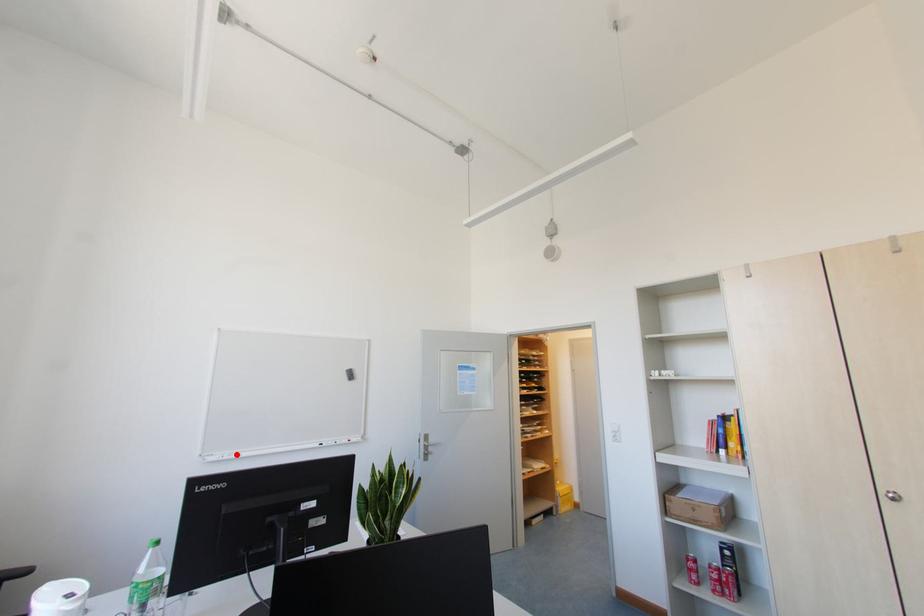
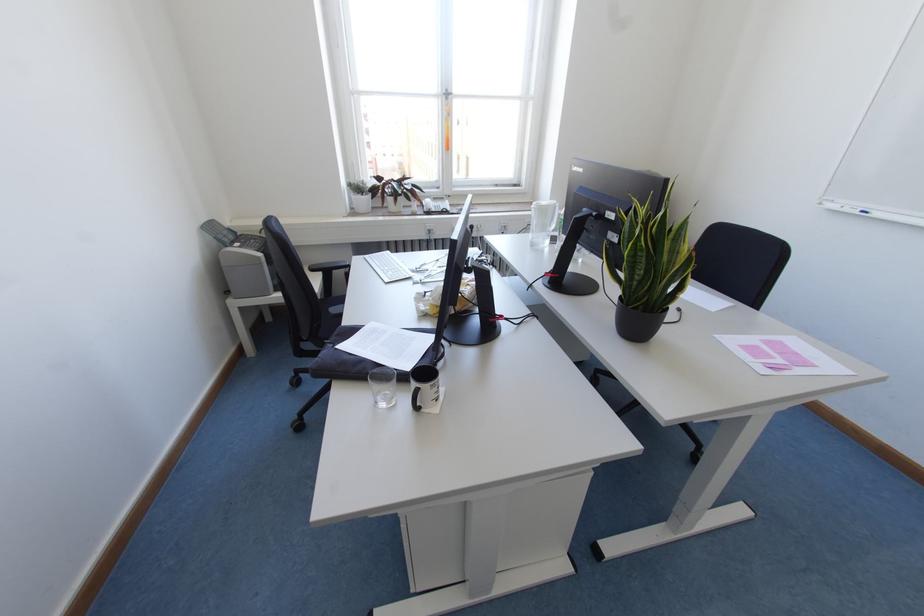
Locate, in the second image, the point that corresponds to the highlighted location in the first image.

(864, 213)